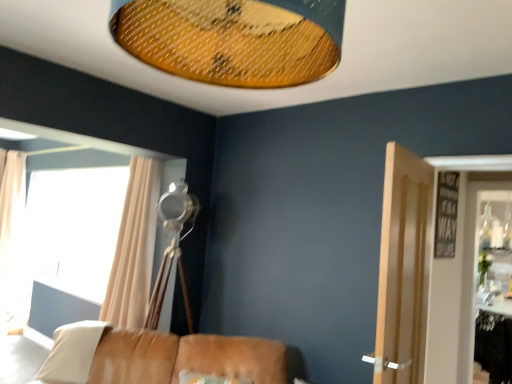
Measure the distance between white fabric pillow at lower left and camera.

white fabric pillow at lower left and camera are 2.43 meters apart.

This screenshot has width=512, height=384. Describe the element at coordinates (403, 268) in the screenshot. I see `light brown wooden door at right` at that location.

Describe the element at coordinates (164, 357) in the screenshot. Image resolution: width=512 pixels, height=384 pixels. I see `leather couch at lower center` at that location.

Describe the element at coordinates (233, 39) in the screenshot. I see `matte orange mesh lampshade at upper center` at that location.

Consider the image. What is the approximate height of black glass table at lower right?

black glass table at lower right is 28.49 inches tall.

At what (x,y) coordinates should I click in order to perform the action: click on white fabric pillow at lower left. Please return your answer as a coordinate pair (x, y). This screenshot has width=512, height=384. Looking at the image, I should click on (72, 352).

Looking at this image, from a real-world perspective, which is physically below, white fabric pillow at lower left or beige fabric curtain at left, which appears as the 1th curtain when viewed from the back?

white fabric pillow at lower left, from a real-world perspective.

Looking at this image, is white fabric pillow at lower left looking in the opposite direction of beige fabric curtain at left, which appears as the 1th curtain when viewed from the back?

white fabric pillow at lower left does not have its back to beige fabric curtain at left, which appears as the 1th curtain when viewed from the back.

Is white fabric pillow at lower left with beige fabric curtain at left, which appears as the 1th curtain when viewed from the back?

There is a gap between white fabric pillow at lower left and beige fabric curtain at left, which appears as the 1th curtain when viewed from the back.

Looking at this image, which is more to the left, beige fabric curtain at left, arranged as the 2th curtain when viewed from the right, or beige fabric curtain at left, which appears as the 2th curtain when viewed from the left?

From the viewer's perspective, beige fabric curtain at left, arranged as the 2th curtain when viewed from the right, appears more on the left side.

Is beige fabric curtain at left, which is the 2th curtain from front to back, looking in the opposite direction of beige fabric curtain at left, which appears as the 2th curtain when viewed from the left?

No, beige fabric curtain at left, which is the 2th curtain from front to back, is not facing the opposite direction of beige fabric curtain at left, which appears as the 2th curtain when viewed from the left.

Would you say beige fabric curtain at left, which is the 2th curtain from front to back, is inside or outside beige fabric curtain at left, arranged as the first curtain when viewed from the right?

beige fabric curtain at left, which is the 2th curtain from front to back, lies outside beige fabric curtain at left, arranged as the first curtain when viewed from the right.

Does beige fabric curtain at left, which ranks as the first curtain in left-to-right order, have a greater width compared to beige fabric curtain at left, arranged as the first curtain when viewed from the right?

Indeed, beige fabric curtain at left, which ranks as the first curtain in left-to-right order, has a greater width compared to beige fabric curtain at left, arranged as the first curtain when viewed from the right.

Considering the sizes of beige fabric curtain at left, arranged as the first curtain when viewed from the right, and black glass table at lower right in the image, is beige fabric curtain at left, arranged as the first curtain when viewed from the right, wider or thinner than black glass table at lower right?

Considering their sizes, beige fabric curtain at left, arranged as the first curtain when viewed from the right, looks broader than black glass table at lower right.

Can you confirm if beige fabric curtain at left, arranged as the first curtain when viewed from the right, is bigger than black glass table at lower right?

Yes, beige fabric curtain at left, arranged as the first curtain when viewed from the right, is bigger than black glass table at lower right.

Is beige fabric curtain at left, which appears as the 2th curtain when viewed from the left, inside the boundaries of black glass table at lower right, or outside?

beige fabric curtain at left, which appears as the 2th curtain when viewed from the left, cannot be found inside black glass table at lower right.

Is beige fabric curtain at left, marked as the first curtain in a front-to-back arrangement, positioned far away from black glass table at lower right?

Indeed, beige fabric curtain at left, marked as the first curtain in a front-to-back arrangement, is not near black glass table at lower right.

Find the location of `table below the light brown wooden door at right (from the image's perspective)`. table below the light brown wooden door at right (from the image's perspective) is located at coordinates (494, 345).

Is light brown wooden door at right completely or partially inside black glass table at lower right?

No, black glass table at lower right does not contain light brown wooden door at right.

Considering the relative sizes of black glass table at lower right and light brown wooden door at right in the image provided, is black glass table at lower right thinner than light brown wooden door at right?

No.

Is light brown wooden door at right next to black glass table at lower right?

No.

How far apart are light brown wooden door at right and black glass table at lower right?

They are 2.27 meters apart.

From the image's perspective, relative to black glass table at lower right, is light brown wooden door at right above or below?

Based on their image positions, light brown wooden door at right is located above black glass table at lower right.

Based on the photo, which is more to the right, light brown wooden door at right or black glass table at lower right?

From the viewer's perspective, black glass table at lower right appears more on the right side.

Which object is closer to the camera taking this photo, beige fabric curtain at left, marked as the first curtain in a front-to-back arrangement, or beige fabric curtain at left, arranged as the 2th curtain when viewed from the right?

beige fabric curtain at left, marked as the first curtain in a front-to-back arrangement, is in front.

Is point (146, 228) farther from camera compared to point (22, 232)?

No, (146, 228) is in front of (22, 232).

Could you tell me if beige fabric curtain at left, arranged as the first curtain when viewed from the right, is turned towards beige fabric curtain at left, which is the 2th curtain from front to back?

No, beige fabric curtain at left, arranged as the first curtain when viewed from the right, is not turned towards beige fabric curtain at left, which is the 2th curtain from front to back.

Which of these two, white fabric pillow at lower left or matte orange mesh lampshade at upper center, is smaller?

white fabric pillow at lower left.

Where is `pillow that is under the matte orange mesh lampshade at upper center (from a real-world perspective)`? This screenshot has width=512, height=384. pillow that is under the matte orange mesh lampshade at upper center (from a real-world perspective) is located at coordinates (72, 352).

Is white fabric pillow at lower left aimed at matte orange mesh lampshade at upper center?

No, white fabric pillow at lower left is not facing towards matte orange mesh lampshade at upper center.

Which is behind, point (65, 335) or point (182, 51)?

The point (65, 335) is farther from the camera.

Locate an element on the screen. The height and width of the screenshot is (384, 512). pillow in front of the beige fabric curtain at left, which ranks as the first curtain in left-to-right order is located at coordinates point(72,352).

The height and width of the screenshot is (384, 512). I want to click on curtain above the beige fabric curtain at left, which ranks as the first curtain in left-to-right order (from a real-world perspective), so click(134, 248).

From the image, which object appears to be farther from light brown wooden door at right, leather couch at lower center or matte orange mesh lampshade at upper center?

matte orange mesh lampshade at upper center is positioned further to the anchor light brown wooden door at right.

When comparing their distances from light brown wooden door at right, does matte orange mesh lampshade at upper center or beige fabric curtain at left, arranged as the 2th curtain when viewed from the right, seem closer?

matte orange mesh lampshade at upper center lies closer to light brown wooden door at right than the other object.

Estimate the real-world distances between objects in this image. Which object is closer to beige fabric curtain at left, which ranks as the first curtain in left-to-right order, black glass table at lower right or matte orange mesh lampshade at upper center?

matte orange mesh lampshade at upper center lies closer to beige fabric curtain at left, which ranks as the first curtain in left-to-right order, than the other object.

Estimate the real-world distances between objects in this image. Which object is further from light brown wooden door at right, beige fabric curtain at left, marked as the first curtain in a front-to-back arrangement, or black glass table at lower right?

black glass table at lower right.

Looking at the image, which one is located further to black glass table at lower right, light brown wooden door at right or white fabric pillow at lower left?

white fabric pillow at lower left is further to black glass table at lower right.

Considering their positions, is beige fabric curtain at left, arranged as the first curtain when viewed from the right, positioned closer to white fabric pillow at lower left than leather couch at lower center?

leather couch at lower center lies closer to white fabric pillow at lower left than the other object.

Estimate the real-world distances between objects in this image. Which object is further from beige fabric curtain at left, arranged as the second curtain when viewed from the back, black glass table at lower right or leather couch at lower center?

black glass table at lower right is further to beige fabric curtain at left, arranged as the second curtain when viewed from the back.

Considering their positions, is matte orange mesh lampshade at upper center positioned further to beige fabric curtain at left, arranged as the second curtain when viewed from the back, than light brown wooden door at right?

Based on the image, matte orange mesh lampshade at upper center appears to be further to beige fabric curtain at left, arranged as the second curtain when viewed from the back.

At what (x,y) coordinates should I click in order to perform the action: click on furniture between beige fabric curtain at left, arranged as the second curtain when viewed from the back, and black glass table at lower right, in the horizontal direction. Please return your answer as a coordinate pair (x, y). The width and height of the screenshot is (512, 384). Looking at the image, I should click on (164, 357).

The height and width of the screenshot is (384, 512). I want to click on furniture positioned between matte orange mesh lampshade at upper center and beige fabric curtain at left, arranged as the first curtain when viewed from the right, from near to far, so tap(164, 357).

At what (x,y) coordinates should I click in order to perform the action: click on pillow located between matte orange mesh lampshade at upper center and beige fabric curtain at left, arranged as the first curtain when viewed from the right, in the depth direction. Please return your answer as a coordinate pair (x, y). Looking at the image, I should click on (72, 352).

You are a GUI agent. You are given a task and a screenshot of the screen. Output one action in this format:
    pyautogui.click(x=<x>, y=<y>)
    Task: Click on the pillow between matte orange mesh lampshade at upper center and beige fabric curtain at left, which appears as the 1th curtain when viewed from the back, from front to back
    
    Given the screenshot: What is the action you would take?
    pyautogui.click(x=72, y=352)